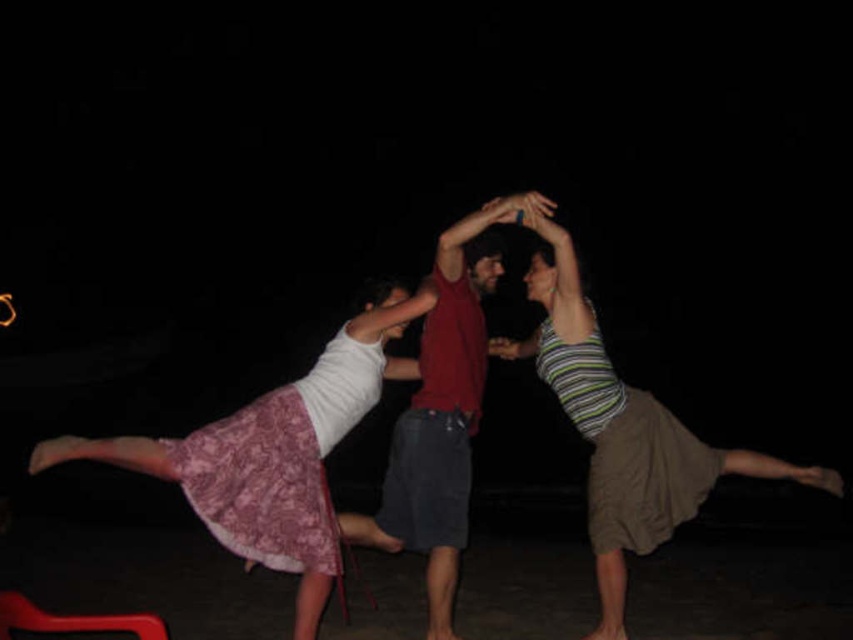
You are at an outdoor event and need to sit down. There is a rubberized red chair at lower left and a matte pink lace skirt at left. Which object is closer to you?

The rubberized red chair at lower left is behind the matte pink lace skirt at left, so the matte pink lace skirt at left is closer to you.

You are a photographer trying to capture the striped cotton tank top at center and the matte red shirt at center in a single frame. Since the two items are overlapping, which one will appear in front in the final photo?

The striped cotton tank top at center is positioned over matte red shirt at center, so it will appear in front in the final photo.

You are a photographer trying to capture the best shot of the scene. You notice a specific point in the image at coordinates point (271, 454). What object is located at this point?

The object at point (271, 454) is the matte pink lace skirt at left.